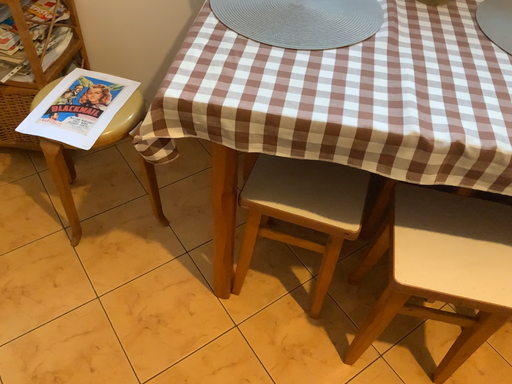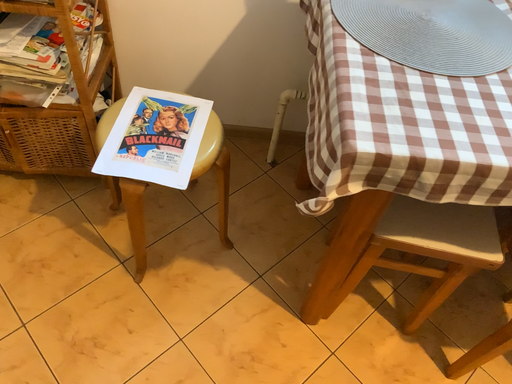
Question: Which way did the camera rotate in the video?

Choices:
 (A) rotated left
 (B) rotated right

Answer: (B)